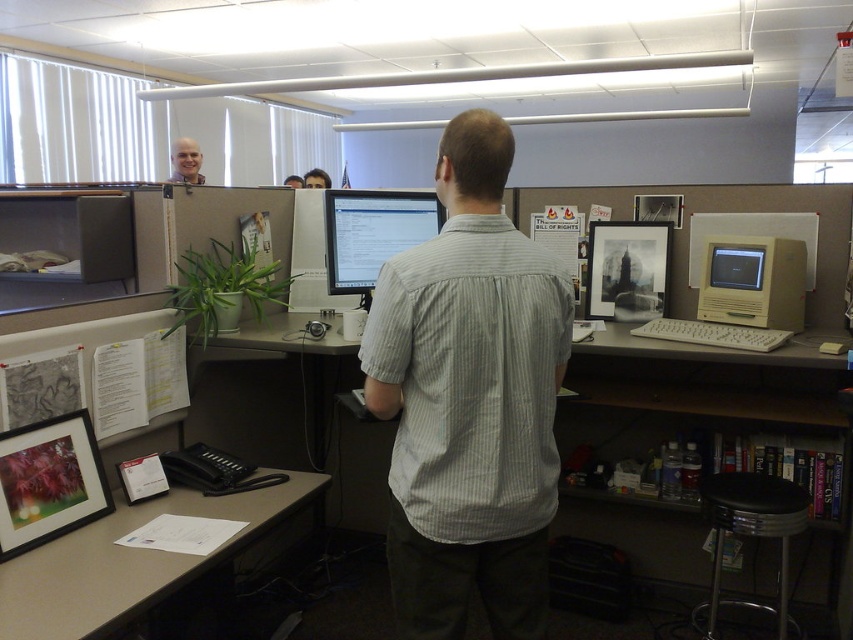
Is beige laminate desk at lower left to the right of smooth skin bald man at upper center from the viewer's perspective?

Indeed, beige laminate desk at lower left is positioned on the right side of smooth skin bald man at upper center.

Is beige laminate desk at lower left below smooth skin bald man at upper center?

Yes, beige laminate desk at lower left is below smooth skin bald man at upper center.

In order to click on beige laminate desk at lower left in this screenshot , I will do [x=128, y=563].

Can you confirm if gray striped shirt at center is bigger than matte black monitor at center?

Yes, gray striped shirt at center is bigger than matte black monitor at center.

Is gray striped shirt at center to the right of matte black monitor at center from the viewer's perspective?

Indeed, gray striped shirt at center is positioned on the right side of matte black monitor at center.

The image size is (853, 640). What do you see at coordinates (469, 400) in the screenshot?
I see `gray striped shirt at center` at bounding box center [469, 400].

Find the location of a particular element. gray striped shirt at center is located at coordinates (469, 400).

Is beige plastic desktop computer at right positioned in front of matte beige monitor at center right?

Yes.

From the picture: Who is more forward, (695, 316) or (734, 282)?

Point (734, 282) is in front.

The width and height of the screenshot is (853, 640). What are the coordinates of `beige plastic desktop computer at right` in the screenshot? It's located at (753, 282).